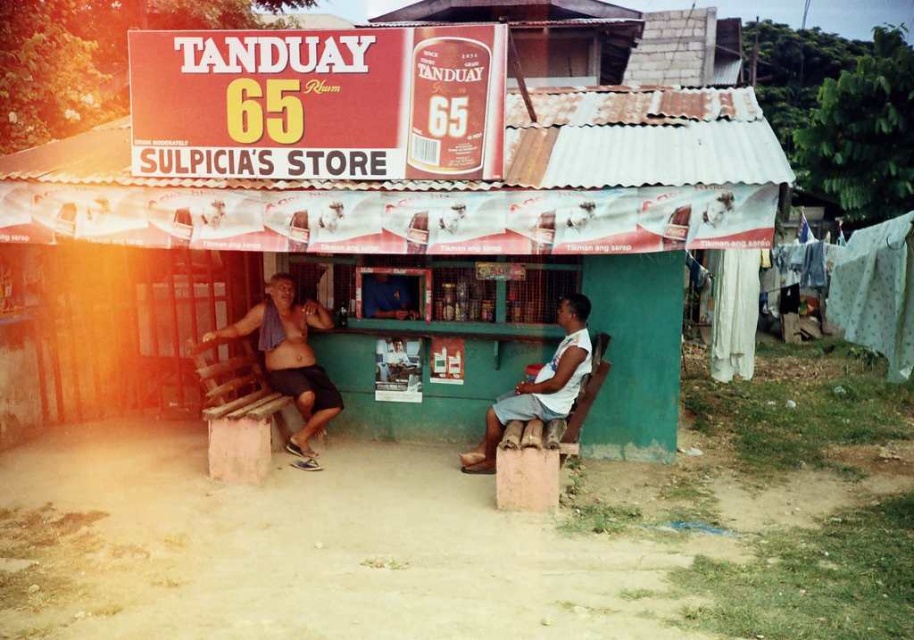
Question: Which point is closer to the camera?

Choices:
 (A) (468, 458)
 (B) (275, 300)

Answer: (A)

Question: Is shiny metallic towel at center to the left of light brown wooden bench at lower right from the viewer's perspective?

Choices:
 (A) no
 (B) yes

Answer: (B)

Question: Is shiny metallic towel at center bigger than light brown wooden bench at lower right?

Choices:
 (A) no
 (B) yes

Answer: (B)

Question: Is shiny metallic towel at center smaller than light brown wooden bench at lower right?

Choices:
 (A) no
 (B) yes

Answer: (A)